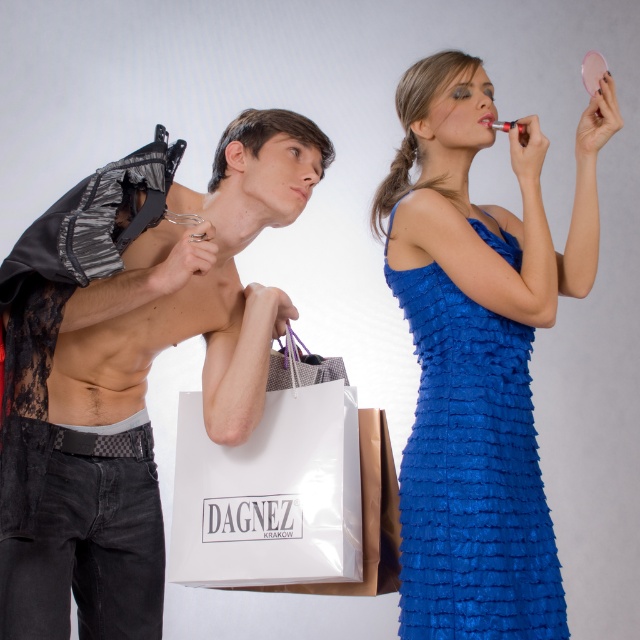
Between lace fabric lingerie at left and blue ruffled fabric dress at upper right, which one appears on the right side from the viewer's perspective?

From the viewer's perspective, blue ruffled fabric dress at upper right appears more on the right side.

Is lace fabric lingerie at left to the left of blue ruffled fabric dress at upper right from the viewer's perspective?

Yes, lace fabric lingerie at left is to the left of blue ruffled fabric dress at upper right.

Describe the element at coordinates (129, 364) in the screenshot. I see `lace fabric lingerie at left` at that location.

Where is `lace fabric lingerie at left`? The image size is (640, 640). lace fabric lingerie at left is located at coordinates (129, 364).

Does blue ruffled fabric dress at upper right appear on the left side of white paper shopping bag at center?

Incorrect, blue ruffled fabric dress at upper right is not on the left side of white paper shopping bag at center.

Is point (481, 308) closer to camera compared to point (321, 435)?

Yes, it is in front of point (321, 435).

Locate an element on the screen. Image resolution: width=640 pixels, height=640 pixels. blue ruffled fabric dress at upper right is located at coordinates (472, 474).

Is lace fabric lingerie at left to the left of white paper shopping bag at center from the viewer's perspective?

Indeed, lace fabric lingerie at left is positioned on the left side of white paper shopping bag at center.

Who is positioned more to the right, lace fabric lingerie at left or white paper shopping bag at center?

white paper shopping bag at center

Between point (77, 387) and point (273, 529), which one is positioned behind?

Positioned behind is point (273, 529).

Where is `lace fabric lingerie at left`? The height and width of the screenshot is (640, 640). lace fabric lingerie at left is located at coordinates (129, 364).